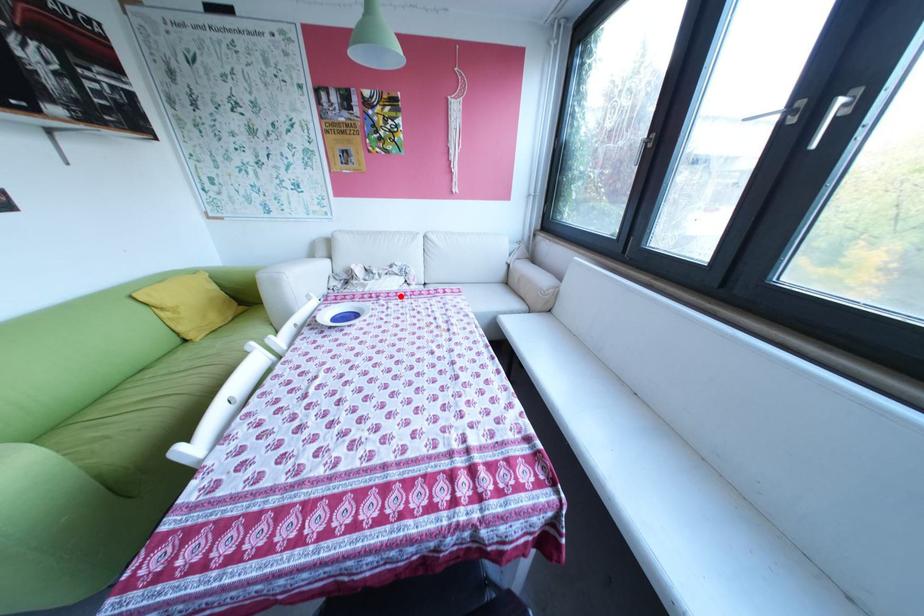
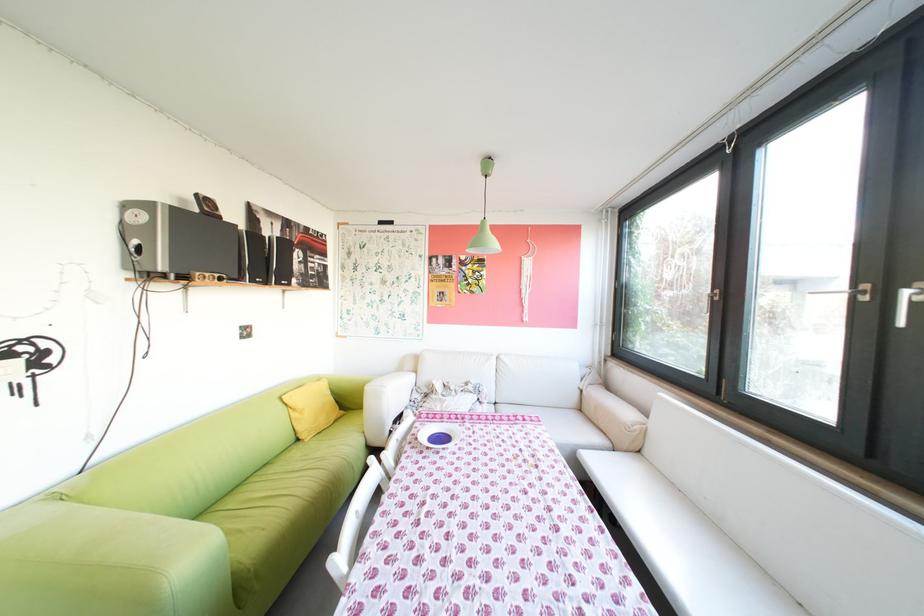
Question: I am providing you with two images of the same scene from different viewpoints. A red point is marked on the first image. Can you still see the location of the red point in image 2?

Choices:
 (A) Yes
 (B) No

Answer: (A)